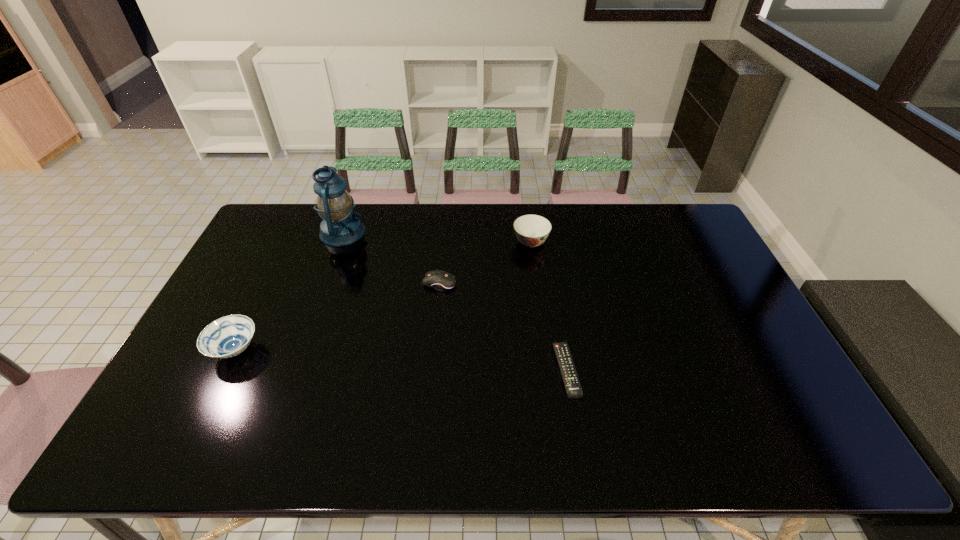
What are the coordinates of `lantern` in the screenshot? It's located at pos(340,227).

This screenshot has width=960, height=540. I want to click on the tallest object, so tap(340, 227).

Locate an element on the screen. The width and height of the screenshot is (960, 540). the farther soup bowl is located at coordinates [532, 230].

In order to click on the nearer soup bowl in this screenshot , I will do `click(228, 336)`.

Where is `the leftmost object`? the leftmost object is located at coordinates (228, 336).

Find the location of `the third object from left to right`. the third object from left to right is located at coordinates (439, 280).

The image size is (960, 540). Find the location of `computer mouse`. computer mouse is located at coordinates (439, 280).

Image resolution: width=960 pixels, height=540 pixels. Identify the location of remote control. (570, 378).

Locate an element on the screen. The image size is (960, 540). vacant space located on the face of the second object from left to right is located at coordinates (382, 233).

The width and height of the screenshot is (960, 540). What are the coordinates of `free space located on the back of the farther soup bowl` in the screenshot? It's located at pos(527,213).